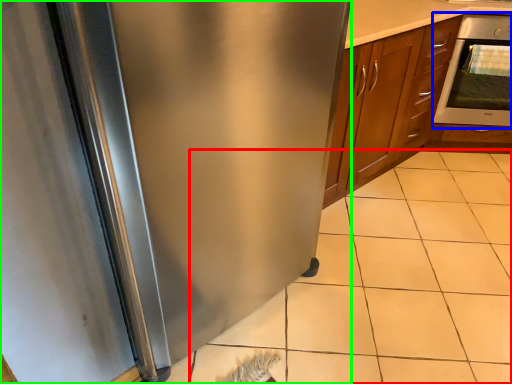
Question: Estimate the real-world distances between objects in this image. Which object is closer to tile (highlighted by a red box), oven (highlighted by a blue box) or refrigerator (highlighted by a green box)?

Choices:
 (A) oven
 (B) refrigerator

Answer: (B)